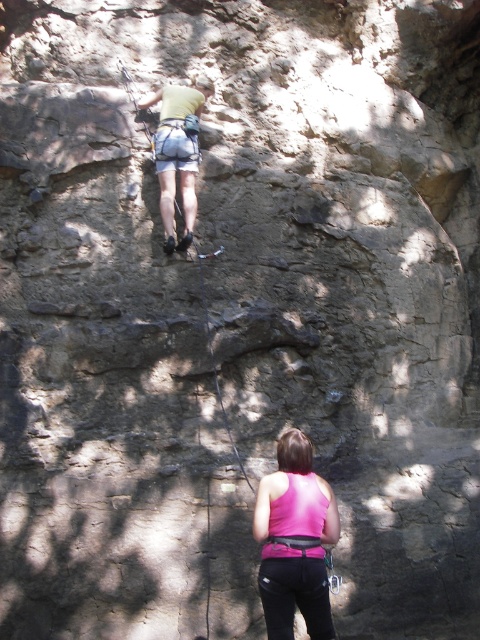
Between point (169, 113) and point (215, 368), which one is positioned in front?

Point (215, 368) is in front.

Which is in front, point (191, 104) or point (196, 252)?

Point (196, 252)

Where is `matte yellow shirt at upper center`? matte yellow shirt at upper center is located at coordinates (178, 152).

Does pink fabric tank top at lower center have a larger size compared to black nylon rope at center?

Indeed, pink fabric tank top at lower center has a larger size compared to black nylon rope at center.

Does pink fabric tank top at lower center have a smaller size compared to black nylon rope at center?

Actually, pink fabric tank top at lower center might be larger than black nylon rope at center.

This screenshot has width=480, height=640. What are the coordinates of `pink fabric tank top at lower center` in the screenshot? It's located at (295, 540).

The image size is (480, 640). Identify the location of pink fabric tank top at lower center. (295, 540).

Between pink fabric tank top at lower center and matte yellow shirt at upper center, which one is positioned lower?

Positioned lower is pink fabric tank top at lower center.

Does pink fabric tank top at lower center have a lesser height compared to matte yellow shirt at upper center?

Yes, pink fabric tank top at lower center is shorter than matte yellow shirt at upper center.

You are a GUI agent. You are given a task and a screenshot of the screen. Output one action in this format:
    pyautogui.click(x=<x>, y=<y>)
    Task: Click on the pink fabric tank top at lower center
    
    Given the screenshot: What is the action you would take?
    (295, 540)